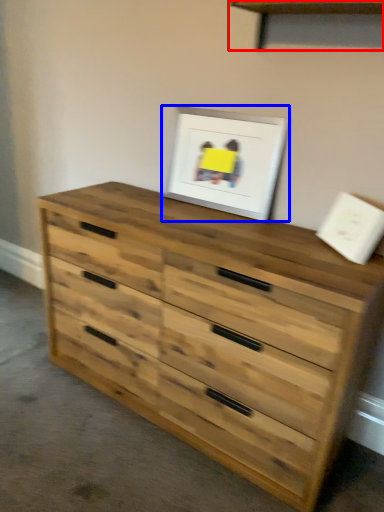
Question: Which object is further to the camera taking this photo, shelf (highlighted by a red box) or picture frame (highlighted by a blue box)?

Choices:
 (A) shelf
 (B) picture frame

Answer: (B)